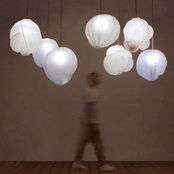
At what (x,y) coordinates should I click in order to perform the action: click on floor. Please return your answer as a coordinate pair (x, y). Looking at the image, I should click on (121, 165).